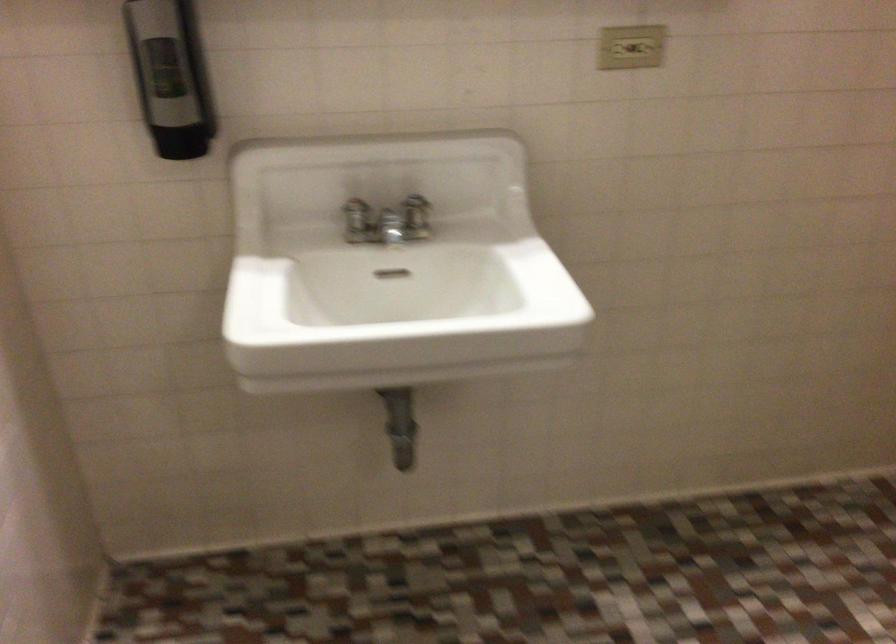
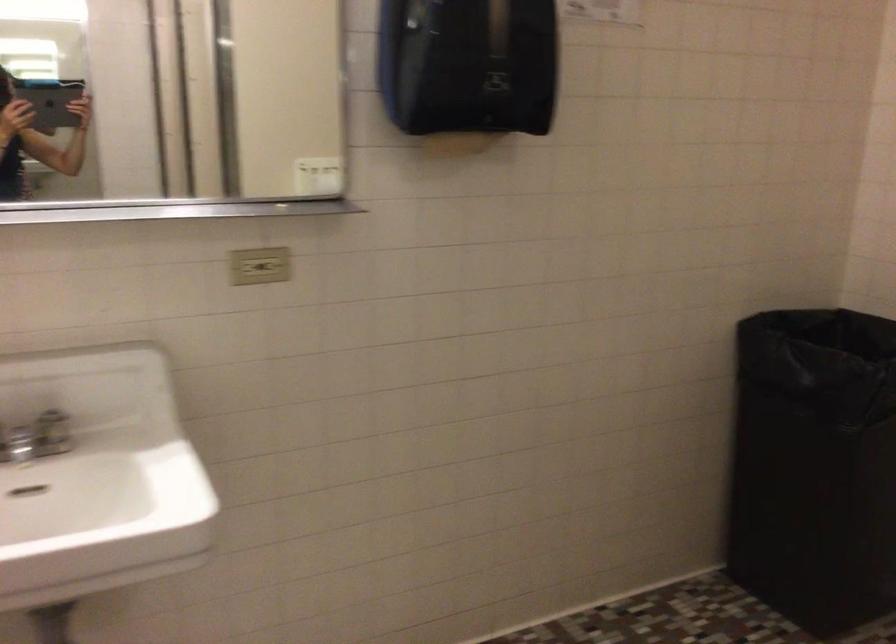
In a continuous first-person perspective shot, in which direction is the camera moving?

The movement direction of the cameraman is right, backward.